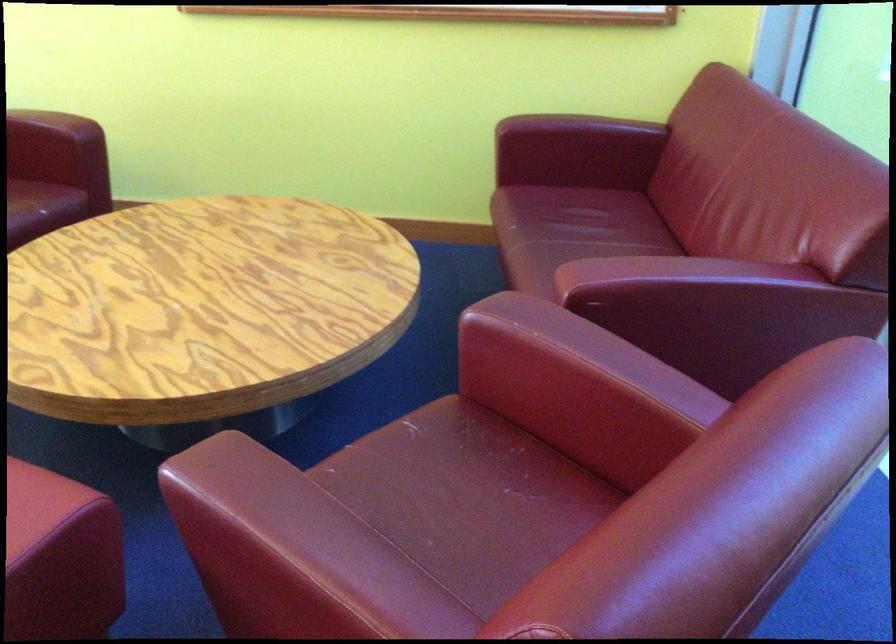
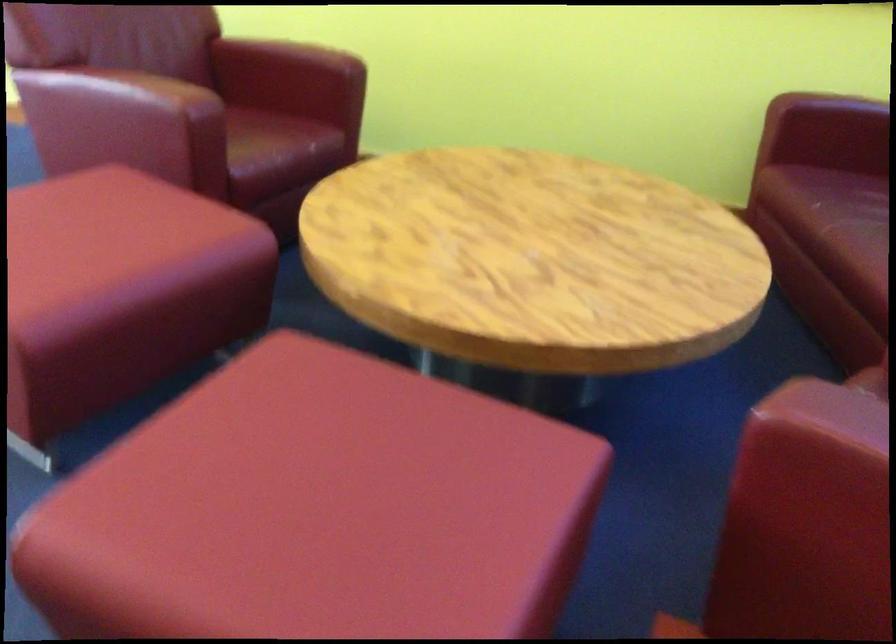
Question: Based on the continuous images, in which direction is the camera rotating? Reply with the corresponding letter.

Choices:
 (A) Left
 (B) Right
 (C) Up
 (D) Down

Answer: (B)